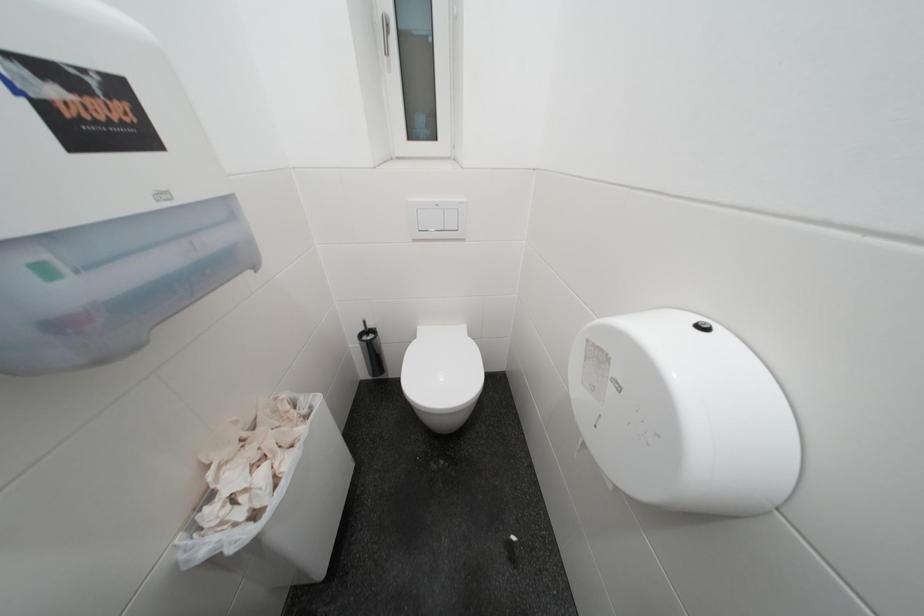
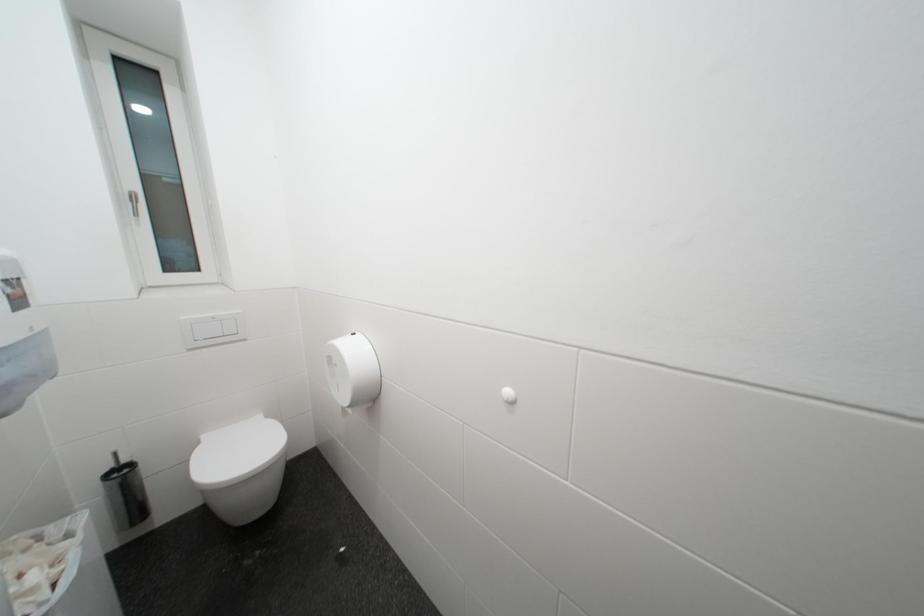
Question: The camera is either moving clockwise (left) or counter-clockwise (right) around the object. The first image is from the beginning of the video and the second image is from the end. Is the camera moving left or right when shooting the video?

Choices:
 (A) Left
 (B) Right

Answer: (A)